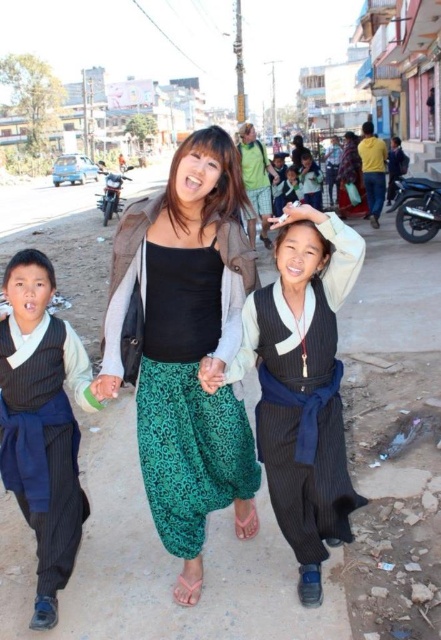
You are a tailor who needs to compare the widths of the dark blue striped vest at left and the green fabric hand at center to decide which requires more fabric. Which object has a greater width?

The dark blue striped vest at left has a greater width than the green fabric hand at center, so it requires more fabric.

In the scene, where is the black pinstriped vest at center located in terms of coordinates?

The black pinstriped vest at center is located at coordinates point (303, 385).

You are a photographer standing at the edge of the street. You want to take a photo of the black pinstriped vest at center and the dark blue fabric pants at center. Given that your camera has a maximum focus range of 30 feet, will both items be in focus?

The black pinstriped vest at center is 33.79 feet away from dark blue fabric pants at center. Since the distance between them exceeds the camera maximum focus range of 30 feet, the camera cannot focus on both items simultaneously.